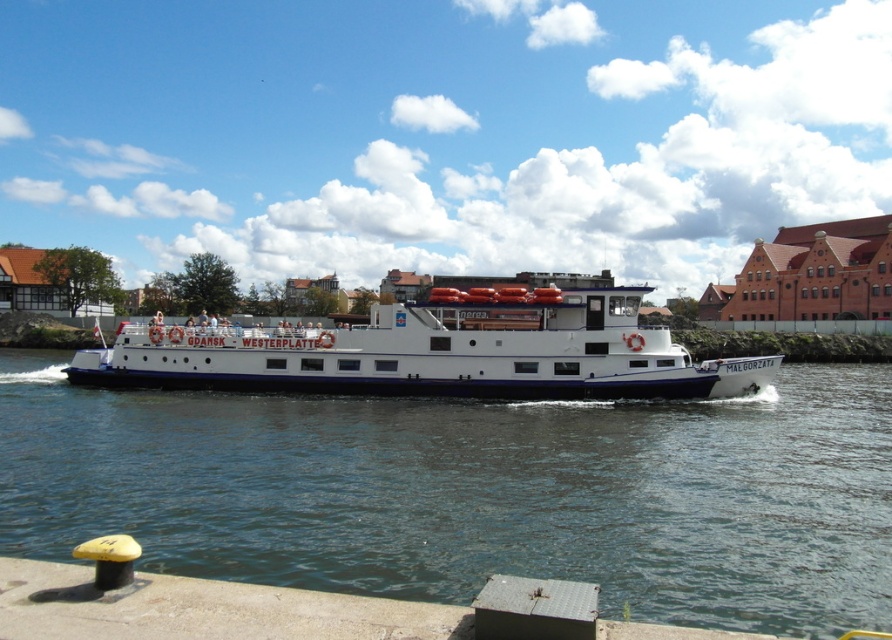
Question: Which point appears closest to the camera in this image?

Choices:
 (A) (344, 531)
 (B) (475, 312)

Answer: (A)

Question: Where is clear blue water at center located in relation to white matte boat at center in the image?

Choices:
 (A) below
 (B) above

Answer: (A)

Question: Which object appears farthest from the camera in this image?

Choices:
 (A) clear blue water at center
 (B) white matte boat at center

Answer: (B)

Question: Does clear blue water at center lie behind white matte boat at center?

Choices:
 (A) no
 (B) yes

Answer: (A)

Question: Is clear blue water at center positioned at the back of white matte boat at center?

Choices:
 (A) yes
 (B) no

Answer: (B)